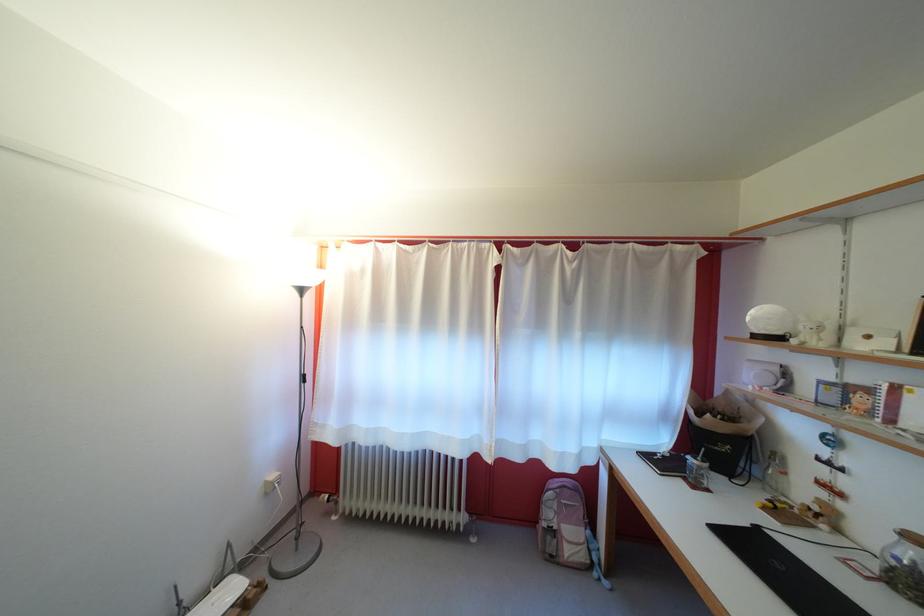
This screenshot has width=924, height=616. I want to click on white radiator knob, so click(323, 492).